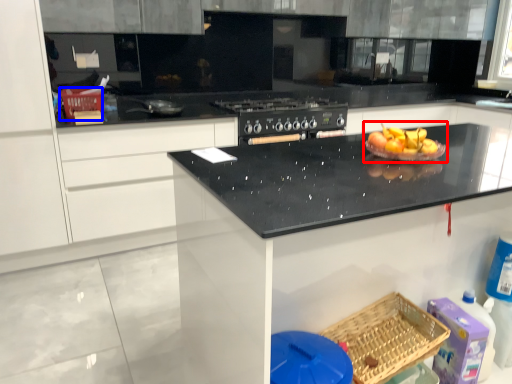
Question: Which object appears farthest to the camera in this image, fruit dish (highlighted by a red box) or basket (highlighted by a blue box)?

Choices:
 (A) fruit dish
 (B) basket

Answer: (B)